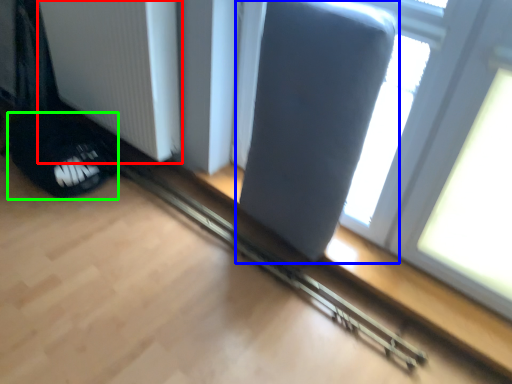
Question: Which object is positioned closest to radiator (highlighted by a red box)? Select from swivel chair (highlighted by a blue box) and footwear (highlighted by a green box).

Choices:
 (A) swivel chair
 (B) footwear

Answer: (B)